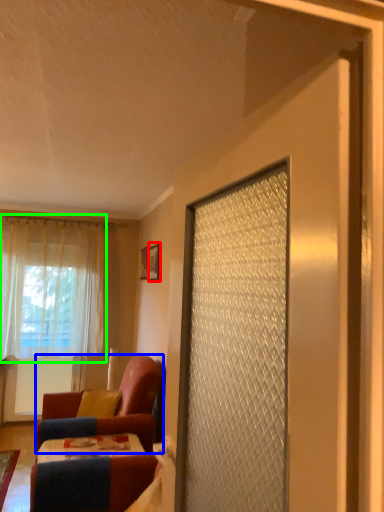
Question: Which object is positioned farthest from picture frame (highlighted by a red box)? Select from chair (highlighted by a blue box) and curtain (highlighted by a green box).

Choices:
 (A) chair
 (B) curtain

Answer: (B)